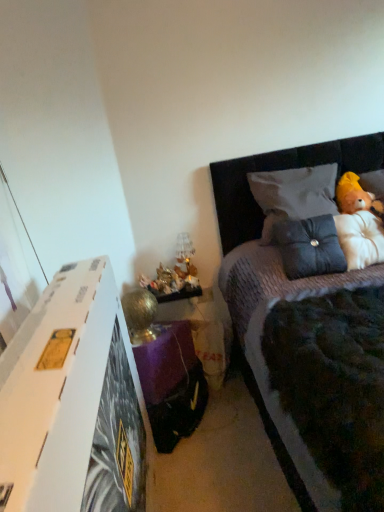
The width and height of the screenshot is (384, 512). What are the coordinates of `vacant space situated above white cardboard at left (from a real-world perspective)` in the screenshot? It's located at (50, 322).